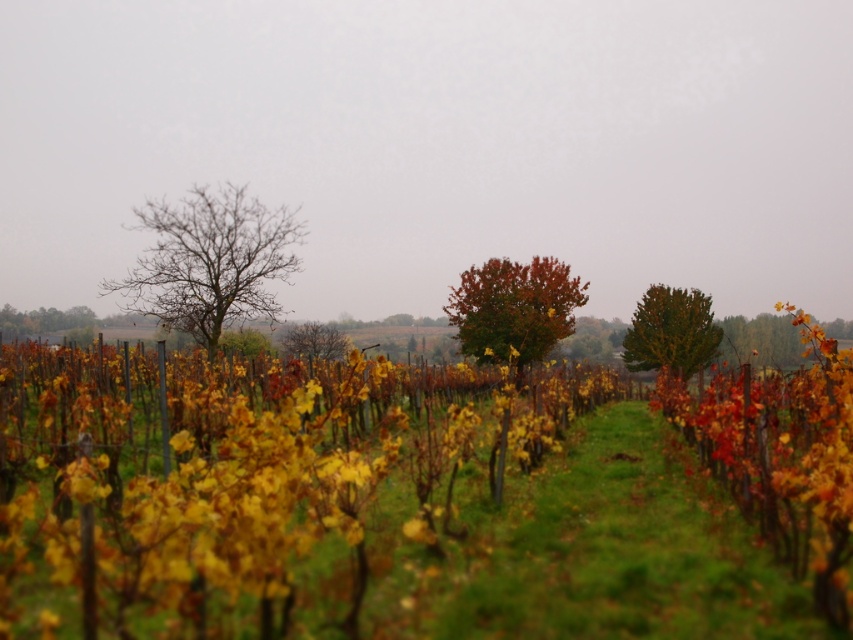
You are standing in the vineyard and want to take a photo of the bare branches at left. What are the coordinates where you should point your camera?

The coordinates for the bare branches at left are point (210,260).